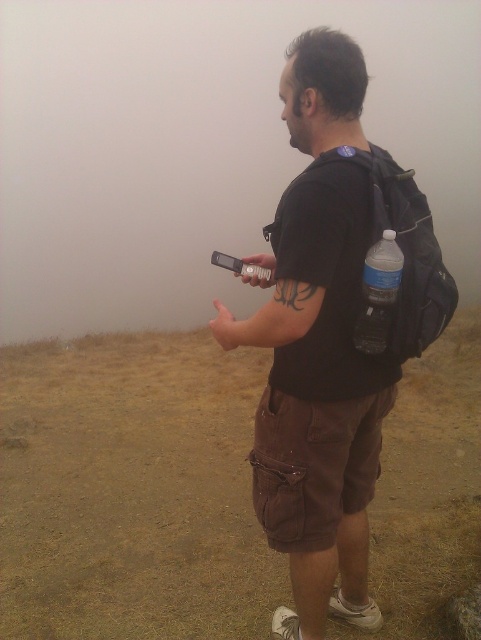
Question: Which point is farther to the camera?

Choices:
 (A) foggy atmosphere at upper center
 (B) black matte shirt at center
 (C) black fabric backpack at upper right
 (D) brushed metal camera at upper center

Answer: (A)

Question: From the image, what is the correct spatial relationship of foggy atmosphere at upper center in relation to black fabric backpack at upper right?

Choices:
 (A) right
 (B) left

Answer: (B)

Question: Which object is farther from the camera taking this photo?

Choices:
 (A) black matte shirt at center
 (B) brushed metal camera at upper center
 (C) black fabric backpack at upper right

Answer: (B)

Question: Is clear plastic water bottle at back further to camera compared to brushed metal camera at upper center?

Choices:
 (A) yes
 (B) no

Answer: (B)

Question: Which of the following is the closest to the observer?

Choices:
 (A) foggy atmosphere at upper center
 (B) clear plastic water bottle at back
 (C) black matte shirt at center
 (D) brushed metal camera at upper center

Answer: (C)

Question: Observing the image, what is the correct spatial positioning of foggy atmosphere at upper center in reference to brushed metal camera at upper center?

Choices:
 (A) left
 (B) right

Answer: (A)